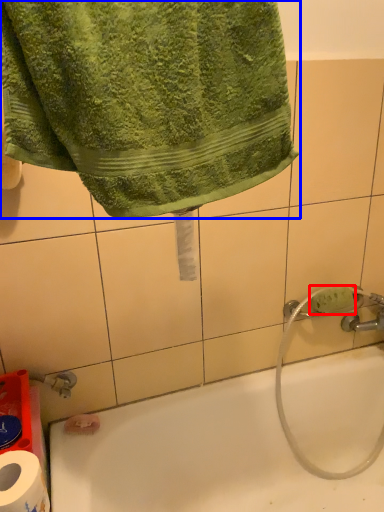
Question: Which object is further to the camera taking this photo, soap (highlighted by a red box) or towel (highlighted by a blue box)?

Choices:
 (A) soap
 (B) towel

Answer: (A)